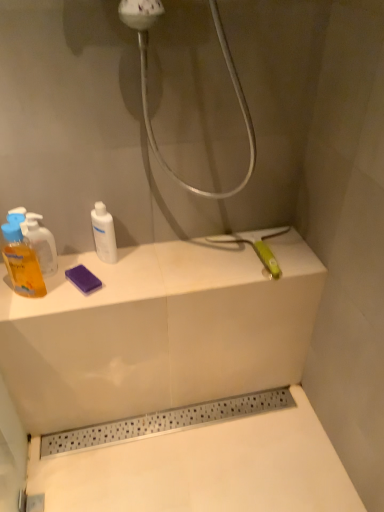
Question: In terms of width, does translucent yellow liquid at left, the first mouthwash when ordered from left to right, look wider or thinner when compared to translucent orange liquid at left, acting as the 2th mouthwash starting from the right?

Choices:
 (A) wide
 (B) thin

Answer: (A)

Question: Based on their positions, is translucent yellow liquid at left, the first mouthwash when ordered from left to right, located to the left or right of translucent orange liquid at left, acting as the 2th mouthwash starting from the right?

Choices:
 (A) right
 (B) left

Answer: (B)

Question: Which is farther from the white glossy bottle at center, which is counted as the 3th mouthwash, starting from the left?

Choices:
 (A) translucent yellow liquid at left, the first mouthwash when ordered from left to right
 (B) translucent orange liquid at left, acting as the second mouthwash starting from the left

Answer: (A)

Question: Considering the real-world distances, which object is farthest from the white glossy bottle at center, which is counted as the 3th mouthwash, starting from the left?

Choices:
 (A) translucent orange liquid at left, acting as the 2th mouthwash starting from the right
 (B) translucent yellow liquid at left, the 3th mouthwash viewed from the right

Answer: (B)